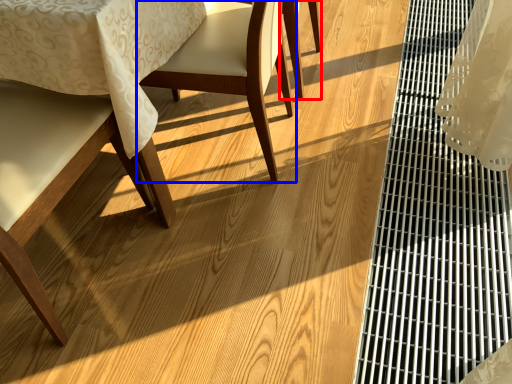
Question: Which point is closer to the camera, chair (highlighted by a red box) or chair (highlighted by a blue box)?

Choices:
 (A) chair
 (B) chair

Answer: (B)